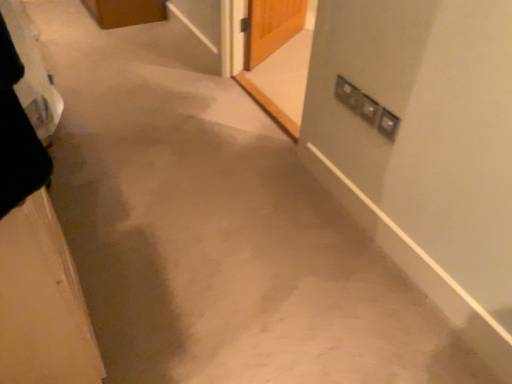
Question: Is transparent glass screen door at upper center, the 1th screen door from the back, smaller than matte silver screen door at upper right, marked as the first screen door in a right-to-left arrangement?

Choices:
 (A) no
 (B) yes

Answer: (B)

Question: Is transparent glass screen door at upper center, which is counted as the 1th screen door, starting from the left, positioned behind matte silver screen door at upper right, the second screen door viewed from the back?

Choices:
 (A) no
 (B) yes

Answer: (B)

Question: Is transparent glass screen door at upper center, the second screen door in the right-to-left sequence, positioned with its back to matte silver screen door at upper right, the 2th screen door positioned from the left?

Choices:
 (A) no
 (B) yes

Answer: (A)

Question: Would you say transparent glass screen door at upper center, arranged as the 2th screen door when viewed from the front, is a long distance from matte silver screen door at upper right, marked as the first screen door in a right-to-left arrangement?

Choices:
 (A) yes
 (B) no

Answer: (B)

Question: Does transparent glass screen door at upper center, the second screen door in the right-to-left sequence, have a greater height compared to matte silver screen door at upper right, marked as the first screen door in a right-to-left arrangement?

Choices:
 (A) no
 (B) yes

Answer: (A)

Question: Does transparent glass screen door at upper center, the 1th screen door from the back, contain matte silver screen door at upper right, marked as the first screen door in a right-to-left arrangement?

Choices:
 (A) no
 (B) yes

Answer: (A)

Question: Could wooden door at left be considered to be inside matte silver screen door at upper right, marked as the first screen door in a right-to-left arrangement?

Choices:
 (A) no
 (B) yes

Answer: (A)

Question: Considering the relative positions of matte silver screen door at upper right, the second screen door viewed from the back, and wooden door at left in the image provided, is matte silver screen door at upper right, the second screen door viewed from the back, behind wooden door at left?

Choices:
 (A) yes
 (B) no

Answer: (A)

Question: Can we say matte silver screen door at upper right, the 2th screen door positioned from the left, lies outside wooden door at left?

Choices:
 (A) yes
 (B) no

Answer: (A)

Question: From the image's perspective, is matte silver screen door at upper right, the 2th screen door positioned from the left, located beneath wooden door at left?

Choices:
 (A) yes
 (B) no

Answer: (B)

Question: Is the depth of matte silver screen door at upper right, the second screen door viewed from the back, less than that of wooden door at left?

Choices:
 (A) yes
 (B) no

Answer: (B)

Question: Does matte silver screen door at upper right, marked as the first screen door in a right-to-left arrangement, have a larger size compared to wooden door at left?

Choices:
 (A) no
 (B) yes

Answer: (B)

Question: Can you confirm if satin silver switch at upper right is bigger than matte silver screen door at upper right, marked as the first screen door in a right-to-left arrangement?

Choices:
 (A) no
 (B) yes

Answer: (A)